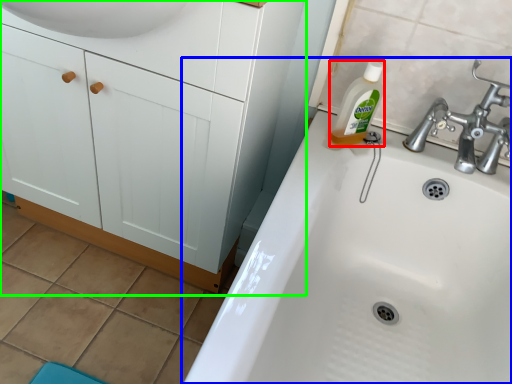
Question: Which object is positioned closest to cleaning product (highlighted by a red box)? Select from sink (highlighted by a blue box) and bathroom cabinet (highlighted by a green box).

Choices:
 (A) sink
 (B) bathroom cabinet

Answer: (A)